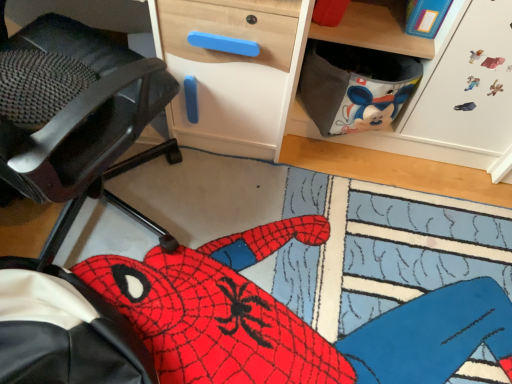
I want to click on black mesh chair at left, so tap(84, 111).

Between point (116, 98) and point (216, 53), which one is positioned in front?

Point (116, 98)

From the image's perspective, who appears lower, black mesh chair at left or wooden desk at upper right?

black mesh chair at left, from the image's perspective.

From the picture: From a real-world perspective, between black mesh chair at left and wooden desk at upper right, who is vertically higher?

black mesh chair at left, from a real-world perspective.

Between black mesh chair at left and wooden desk at upper right, which one has more height?

With more height is wooden desk at upper right.

Can you confirm if wooden desk at upper right is positioned to the right of black mesh chair at left?

Indeed, wooden desk at upper right is positioned on the right side of black mesh chair at left.

Is wooden desk at upper right wider or thinner than black mesh chair at left?

Clearly, wooden desk at upper right has more width compared to black mesh chair at left.

The image size is (512, 384). Identify the location of chair that is in front of the wooden desk at upper right. (84, 111).

Are wooden desk at upper right and black mesh chair at left located far from each other?

Actually, wooden desk at upper right and black mesh chair at left are a little close together.

Who is smaller, black mesh chair at left or red plush spider at lower left?

black mesh chair at left is smaller.

Is black mesh chair at left far away from red plush spider at lower left?

No, black mesh chair at left is in close proximity to red plush spider at lower left.

From the picture: How different are the orientations of black mesh chair at left and red plush spider at lower left in degrees?

The facing directions of black mesh chair at left and red plush spider at lower left are 58.6 degrees apart.

Is black mesh chair at left outside of red plush spider at lower left?

black mesh chair at left is positioned outside red plush spider at lower left.

Looking at the image, does wooden desk at upper right seem bigger or smaller compared to red plush spider at lower left?

In the image, wooden desk at upper right appears to be larger than red plush spider at lower left.

Is wooden desk at upper right outside of red plush spider at lower left?

Yes, wooden desk at upper right is not within red plush spider at lower left.

Where is `animal below the wooden desk at upper right (from a real-world perspective)`? This screenshot has height=384, width=512. animal below the wooden desk at upper right (from a real-world perspective) is located at coordinates (289, 318).

Which object is closer to the camera, red plush spider at lower left or wooden desk at upper right?

wooden desk at upper right is in front.

Locate an element on the screen. computer desk that is on the right side of red plush spider at lower left is located at coordinates (340, 42).

Considering the relative sizes of red plush spider at lower left and wooden desk at upper right in the image provided, is red plush spider at lower left thinner than wooden desk at upper right?

No.

From a real-world perspective, which is physically above, red plush spider at lower left or wooden desk at upper right?

wooden desk at upper right is physically above.

Where is `chair that appears above the red plush spider at lower left (from the image's perspective)`? Image resolution: width=512 pixels, height=384 pixels. chair that appears above the red plush spider at lower left (from the image's perspective) is located at coordinates (84, 111).

Would you consider red plush spider at lower left to be distant from black mesh chair at left?

No, there isn't a large distance between red plush spider at lower left and black mesh chair at left.

Is black mesh chair at left at the back of red plush spider at lower left?

No, red plush spider at lower left's orientation is not away from black mesh chair at left.

Image resolution: width=512 pixels, height=384 pixels. In order to click on chair lying in front of the wooden desk at upper right in this screenshot , I will do pyautogui.click(x=84, y=111).

The width and height of the screenshot is (512, 384). Find the location of `chair that appears below the wooden desk at upper right (from the image's perspective)`. chair that appears below the wooden desk at upper right (from the image's perspective) is located at coordinates (84, 111).

From the image, which object appears to be nearer to wooden desk at upper right, black mesh chair at left or red plush spider at lower left?

The object closer to wooden desk at upper right is black mesh chair at left.

Which object lies nearer to the anchor point red plush spider at lower left, wooden desk at upper right or black mesh chair at left?

wooden desk at upper right is closer to red plush spider at lower left.

From the image, which object appears to be nearer to black mesh chair at left, wooden desk at upper right or red plush spider at lower left?

Among the two, wooden desk at upper right is located nearer to black mesh chair at left.

Based on their spatial positions, is red plush spider at lower left or wooden desk at upper right closer to black mesh chair at left?

wooden desk at upper right is closer to black mesh chair at left.

Which object lies further to the anchor point red plush spider at lower left, black mesh chair at left or wooden desk at upper right?

black mesh chair at left lies further to red plush spider at lower left than the other object.

Looking at the image, which one is located closer to wooden desk at upper right, red plush spider at lower left or black mesh chair at left?

black mesh chair at left is closer to wooden desk at upper right.

The height and width of the screenshot is (384, 512). What are the coordinates of `animal between black mesh chair at left and wooden desk at upper right from left to right` in the screenshot? It's located at (289, 318).